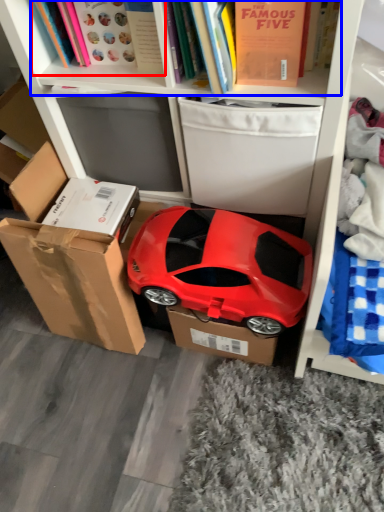
Question: Which object is closer to the camera taking this photo, book (highlighted by a red box) or book (highlighted by a blue box)?

Choices:
 (A) book
 (B) book

Answer: (B)